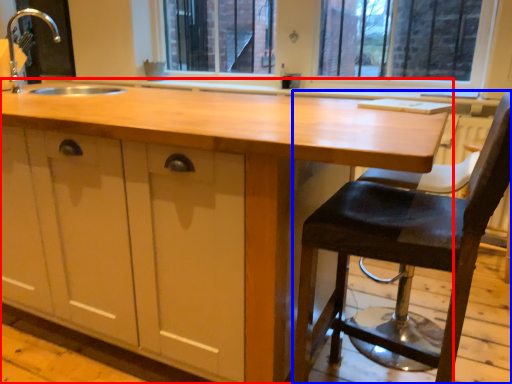
Question: Which of the following is the farthest to the observer, countertop (highlighted by a red box) or chair (highlighted by a blue box)?

Choices:
 (A) countertop
 (B) chair

Answer: (A)